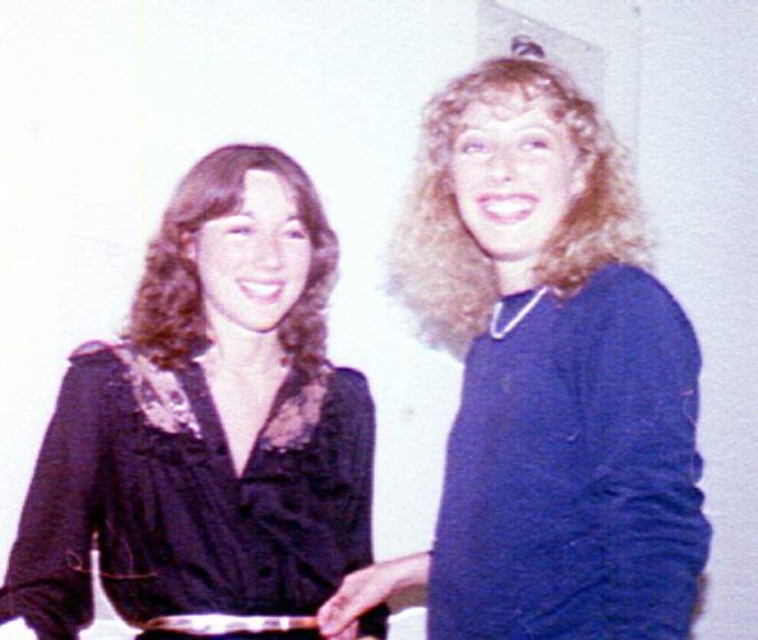
Does point (262, 604) come closer to viewer compared to point (680, 332)?

That is False.

Which is in front, point (230, 550) or point (471, 440)?

Point (471, 440) is more forward.

You are a GUI agent. You are given a task and a screenshot of the screen. Output one action in this format:
    pyautogui.click(x=<x>, y=<y>)
    Task: Click on the black satin blouse at left
    The image size is (758, 640).
    Given the screenshot: What is the action you would take?
    pyautogui.click(x=205, y=422)

Is blue woolen sweater at right above blue matte sweater at right?

Indeed, blue woolen sweater at right is positioned over blue matte sweater at right.

Can you confirm if blue woolen sweater at right is thinner than blue matte sweater at right?

Incorrect, blue woolen sweater at right's width is not less than blue matte sweater at right's.

Where is `blue woolen sweater at right`? This screenshot has height=640, width=758. blue woolen sweater at right is located at coordinates 547,380.

Is blue woolen sweater at right positioned at the back of black satin blouse at left?

No, it is in front of black satin blouse at left.

Who is shorter, blue woolen sweater at right or black satin blouse at left?

black satin blouse at left

Who is more forward, (x=522, y=198) or (x=224, y=522)?

Point (x=522, y=198)

Image resolution: width=758 pixels, height=640 pixels. Find the location of `blue woolen sweater at right`. blue woolen sweater at right is located at coordinates (547, 380).